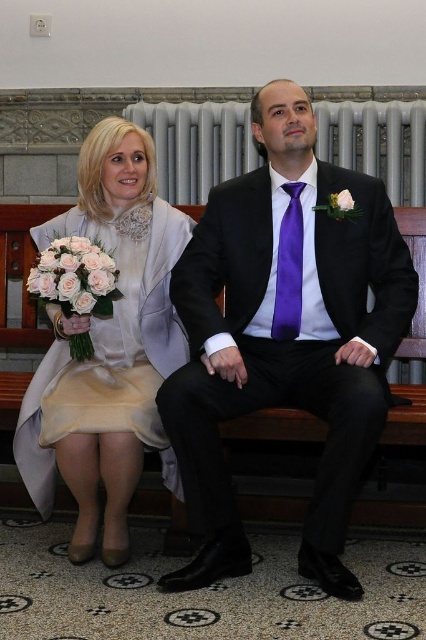
Question: Which of these objects is positioned closest to the metallic radiator at upper center?

Choices:
 (A) satin white dress at left
 (B) pale pink silk bouquet at left
 (C) white silk flower at center

Answer: (A)

Question: Does pale pink silk bouquet at left come in front of white silk flower at center?

Choices:
 (A) yes
 (B) no

Answer: (A)

Question: Can you confirm if metallic radiator at upper center is thinner than pale pink silk bouquet at left?

Choices:
 (A) yes
 (B) no

Answer: (B)

Question: Can you confirm if matte black suit at center is smaller than pale pink silk bouquet at left?

Choices:
 (A) no
 (B) yes

Answer: (A)

Question: Which object is the farthest from the matte black suit at center?

Choices:
 (A) white silk flower at center
 (B) satin white dress at left

Answer: (A)

Question: Which point is farther from the camera taking this photo?

Choices:
 (A) (271, 195)
 (B) (293, 205)

Answer: (A)